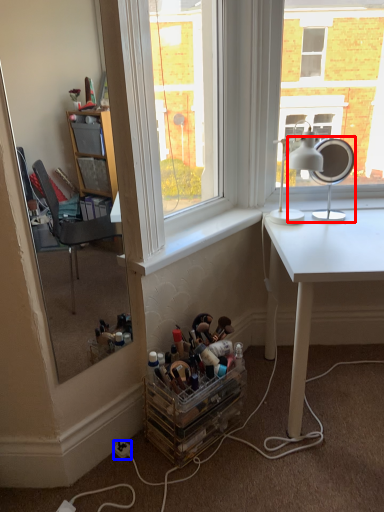
Question: Which object appears closest to the camera in this image, table lamp (highlighted by a red box) or power outlet (highlighted by a blue box)?

Choices:
 (A) table lamp
 (B) power outlet

Answer: (B)